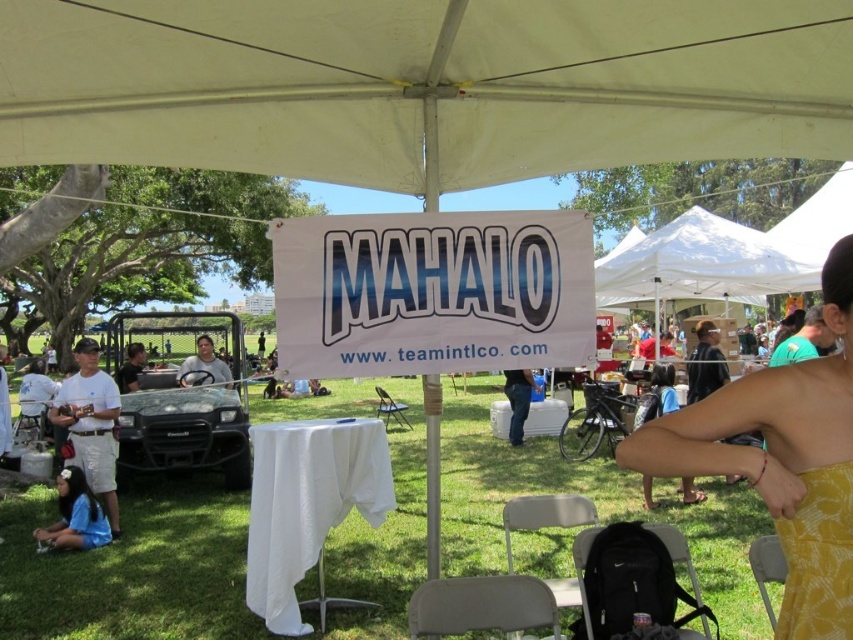
Can you confirm if white cotton shirt at left is thinner than blue fabric shirt at lower left?

Indeed, white cotton shirt at left has a lesser width compared to blue fabric shirt at lower left.

You are a GUI agent. You are given a task and a screenshot of the screen. Output one action in this format:
    pyautogui.click(x=<x>, y=<y>)
    Task: Click on the white cotton shirt at left
    Image resolution: width=853 pixels, height=640 pixels.
    Given the screenshot: What is the action you would take?
    pyautogui.click(x=91, y=424)

Does white paper banner at center have a greater height compared to white fabric tent at upper center?

Incorrect, white paper banner at center's height is not larger of white fabric tent at upper center's.

Does white paper banner at center have a larger size compared to white fabric tent at upper center?

Actually, white paper banner at center might be smaller than white fabric tent at upper center.

Who is more forward, (561, 211) or (633, 300)?

Positioned in front is point (561, 211).

This screenshot has height=640, width=853. What are the coordinates of `white paper banner at center` in the screenshot? It's located at (432, 292).

What are the coordinates of `matte black golf cart at center` in the screenshot? It's located at (202, 365).

Is point (218, 378) positioned after point (521, 424)?

No, it is in front of (521, 424).

Identify the location of matte black golf cart at center. The image size is (853, 640). (202, 365).